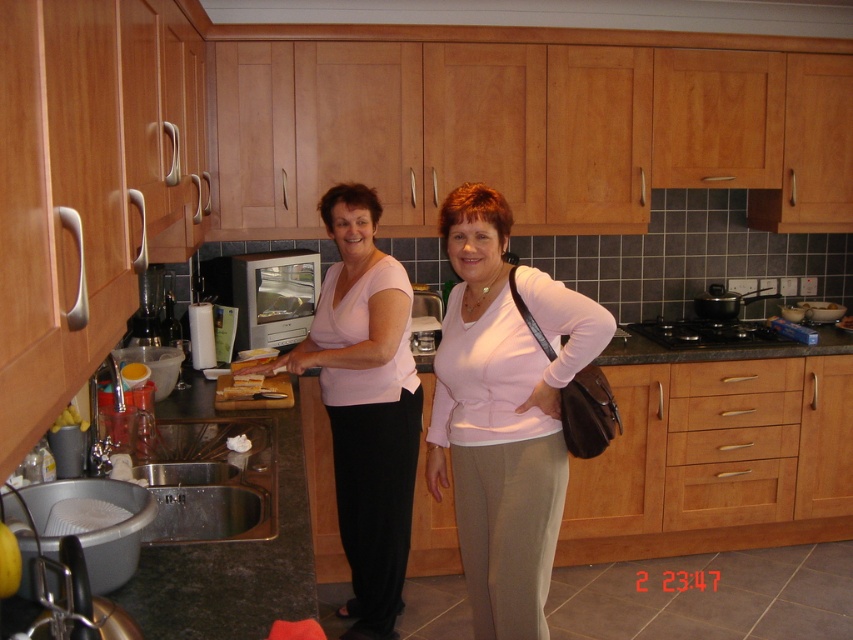
You are organizing the kitchen and need to place a new spice jar on the countertop. The wooden drawer at center is in the way. Can you move the pink matte shirt at center to make space?

The pink matte shirt at center is positioned under the wooden drawer at center, so moving the shirt would not affect the drawer. You can place the spice jar on the countertop without moving the shirt since they are at different levels.

Looking at this image, you are organizing a kitchen inventory and need to determine if the pink matte shirt at center can be stored inside the wooden drawer at center. Based on their sizes, can the shirt fit inside the drawer?

The pink matte shirt at center is larger in size than the wooden drawer at center, so it cannot fit inside the drawer.

From the picture: You are organizing a dinner party and need to prepare a large amount of vegetables. Which object in the scene, the granite countertop at center or the stainless steel sink at lower left, would provide more space for chopping vegetables?

The granite countertop at center has a larger size compared to the stainless steel sink at lower left, so it would provide more space for chopping vegetables.